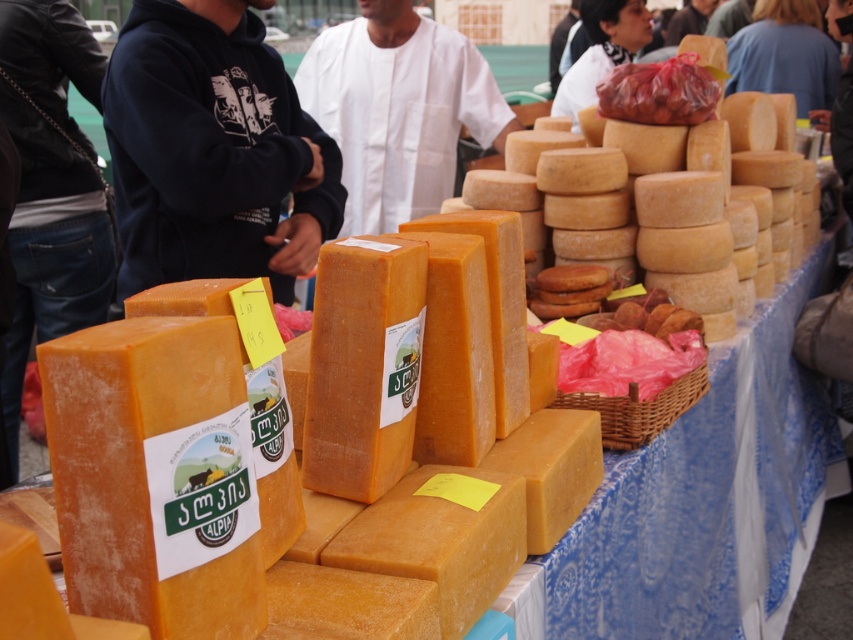
Question: Which point is closer to the camera?

Choices:
 (A) (360, 292)
 (B) (223, 102)
 (C) (426, 54)
 (D) (614, 88)

Answer: (A)

Question: Does dark blue hoodie at center have a lesser width compared to orange hard cheese at center?

Choices:
 (A) yes
 (B) no

Answer: (A)

Question: Is dark blue hoodie at center bigger than shiny plastic bag of meat at upper right?

Choices:
 (A) yes
 (B) no

Answer: (A)

Question: Which object is the farthest from the white cloth at center?

Choices:
 (A) orange hard cheese at center
 (B) shiny plastic bag of meat at upper right

Answer: (A)

Question: Which of the following is the farthest from the observer?

Choices:
 (A) (637, 77)
 (B) (218, 241)
 (C) (381, 186)

Answer: (C)

Question: Can you confirm if orange hard cheese at center is smaller than white cloth at center?

Choices:
 (A) yes
 (B) no

Answer: (A)